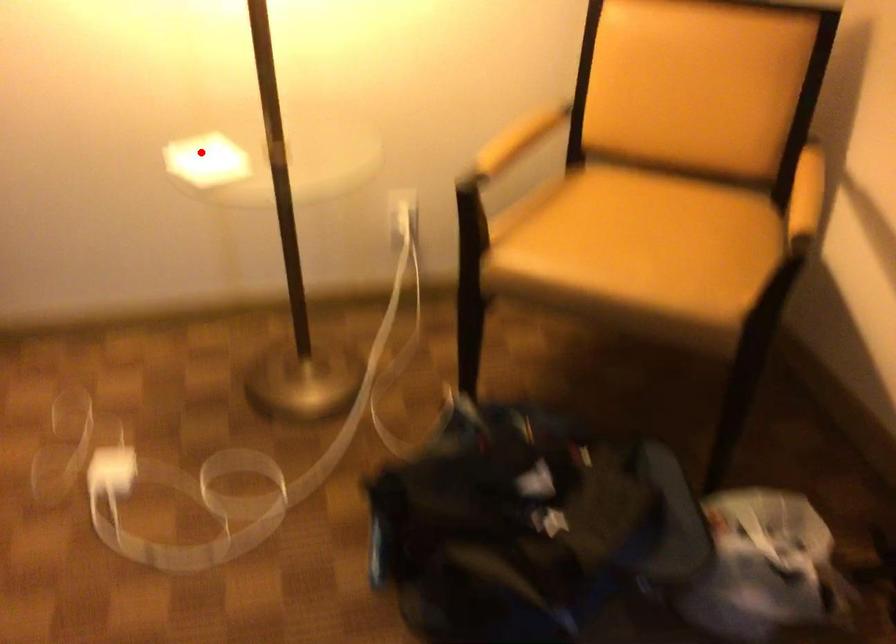
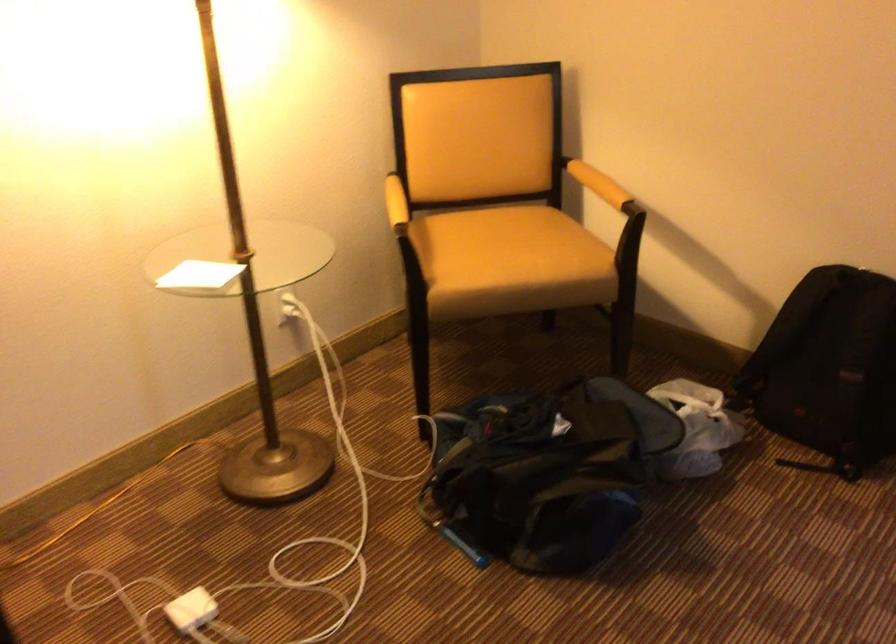
Locate, in the second image, the point that corresponds to the highlighted location in the first image.

(199, 275)